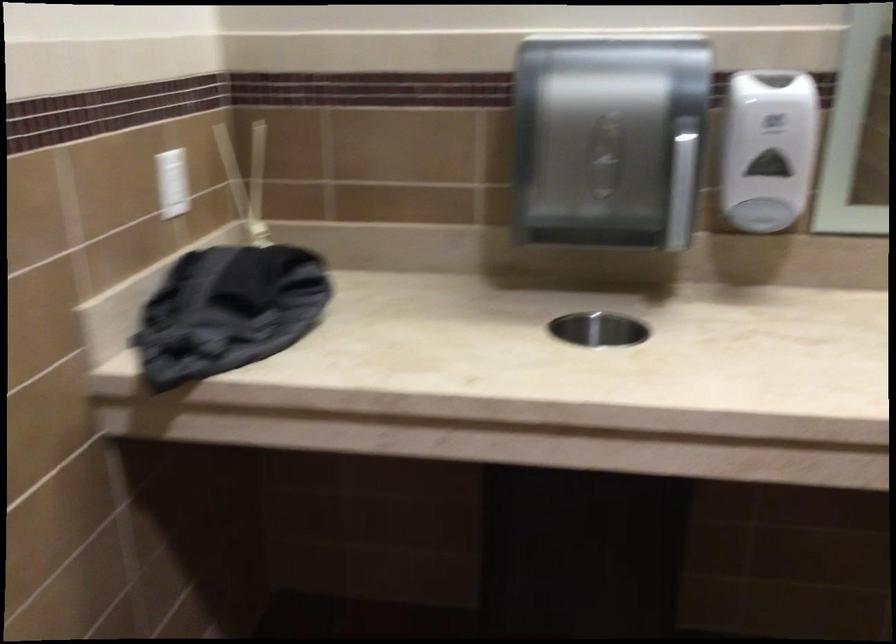
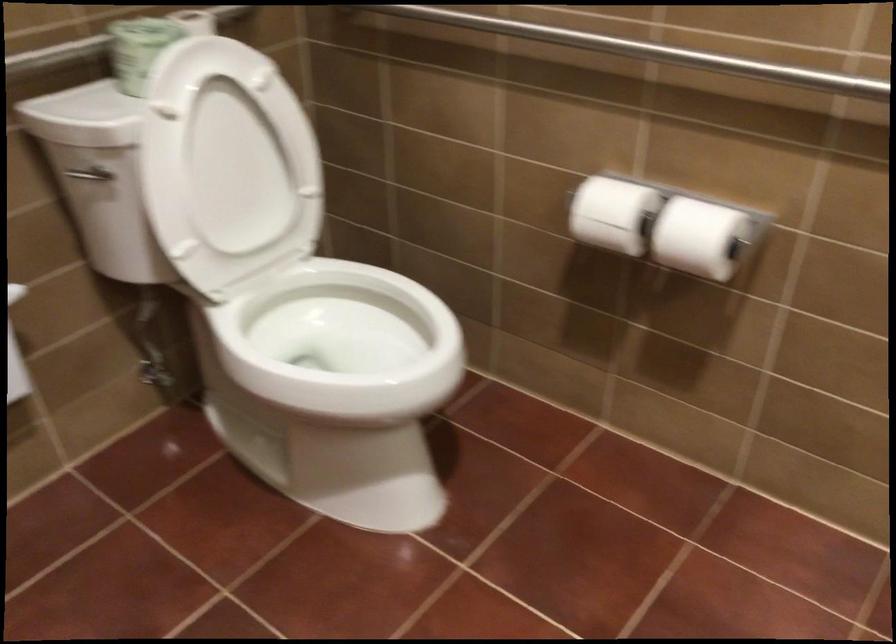
The first image is from the beginning of the video and the second image is from the end. How did the camera likely rotate when shooting the video?

The rotation direction of the camera is left-down.